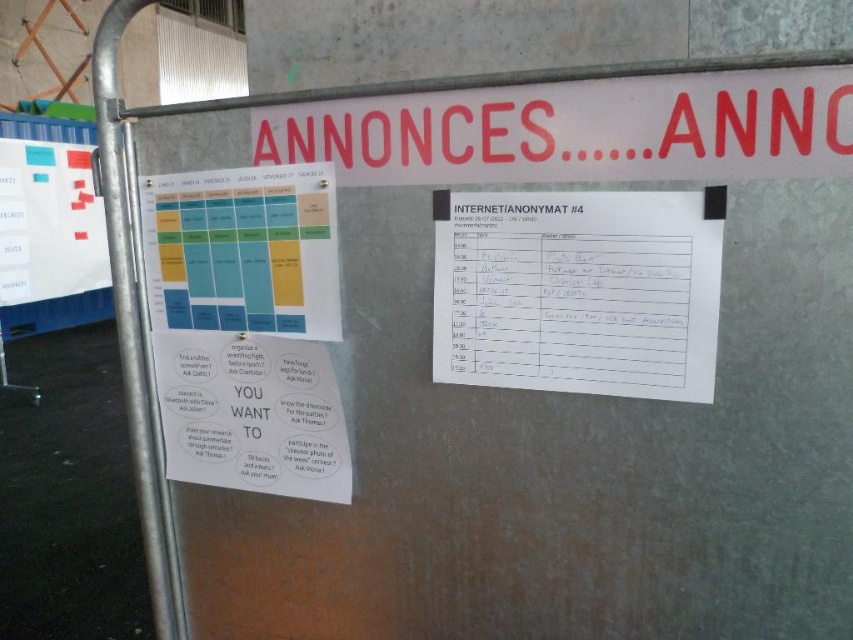
Does point (799, 168) come behind point (38, 196)?

No, it is not.

Does white paper sign at upper center appear over white paper with colorful stickers at left?

Incorrect, white paper sign at upper center is not positioned above white paper with colorful stickers at left.

Between point (824, 77) and point (96, 216), which one is positioned in front?

Point (824, 77)

At what (x,y) coordinates should I click in order to perform the action: click on white paper sign at upper center. Please return your answer as a coordinate pair (x, y). The width and height of the screenshot is (853, 640). Looking at the image, I should click on tap(578, 129).

Between point (210, 218) and point (305, 189), which one is positioned behind?

The point (210, 218) is more distant.

Is point (299, 237) closer to viewer compared to point (202, 221)?

Yes, point (299, 237) is closer to viewer.

Between point (302, 440) and point (224, 304), which one is positioned in front?

Point (302, 440)

What are the coordinates of `matte paper poster at center` in the screenshot? It's located at (247, 326).

Is matte plastic calendar at center below white paper with colorful stickers at left?

Yes, matte plastic calendar at center is below white paper with colorful stickers at left.

Which is below, matte plastic calendar at center or white paper with colorful stickers at left?

Positioned lower is matte plastic calendar at center.

Between point (202, 294) and point (0, 276), which one is positioned behind?

Positioned behind is point (0, 276).

At what (x,y) coordinates should I click in order to perform the action: click on matte plastic calendar at center. Please return your answer as a coordinate pair (x, y). Looking at the image, I should click on (242, 250).